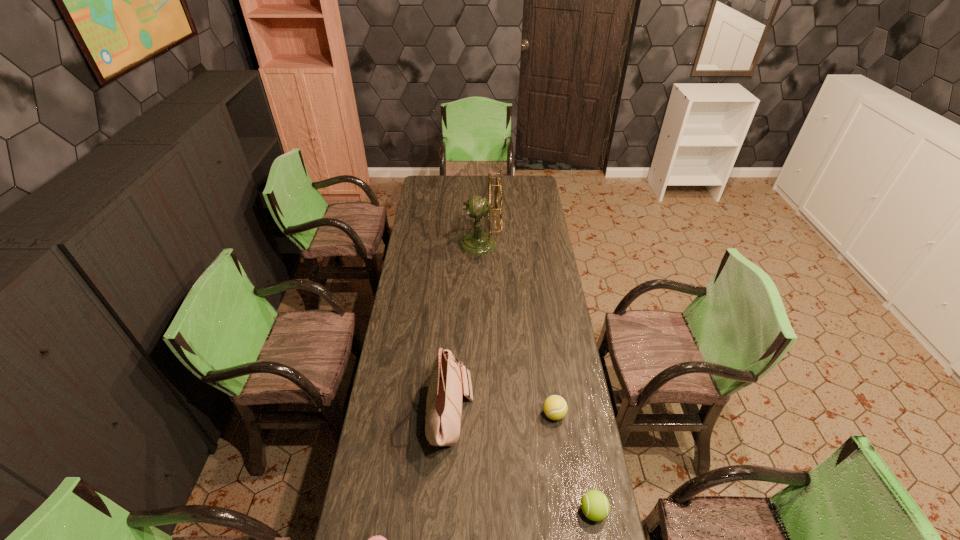
Locate an element on the screen. the farthest object is located at coordinates (477, 207).

Image resolution: width=960 pixels, height=540 pixels. What are the coordinates of `handbag` in the screenshot? It's located at (443, 418).

Where is `the farther tennis ball`? The height and width of the screenshot is (540, 960). the farther tennis ball is located at coordinates (555, 407).

In order to click on the nearer tennis ball in this screenshot , I will do `click(594, 504)`.

In order to click on blank space located 0.220m in front of the farthest object, directing air flow in this screenshot , I will do coord(542,244).

Locate an element on the screen. This screenshot has width=960, height=540. free point located on the side of the handbag with the attached pouch is located at coordinates (551, 413).

Where is `vacant space located on the left of the farther tennis ball`? This screenshot has width=960, height=540. vacant space located on the left of the farther tennis ball is located at coordinates (517, 414).

You are a GUI agent. You are given a task and a screenshot of the screen. Output one action in this format:
    pyautogui.click(x=<x>, y=<y>)
    Task: Click on the vacant region located on the left of the nearer tennis ball
    
    Given the screenshot: What is the action you would take?
    pyautogui.click(x=493, y=511)

Find the location of a particular element. Image resolution: width=960 pixels, height=540 pixels. free space at the far edge of the desktop is located at coordinates (457, 177).

You are a GUI agent. You are given a task and a screenshot of the screen. Output one action in this format:
    pyautogui.click(x=<x>, y=<y>)
    Task: Click on the vacant space at the left edge of the desktop
    
    Given the screenshot: What is the action you would take?
    pyautogui.click(x=424, y=245)